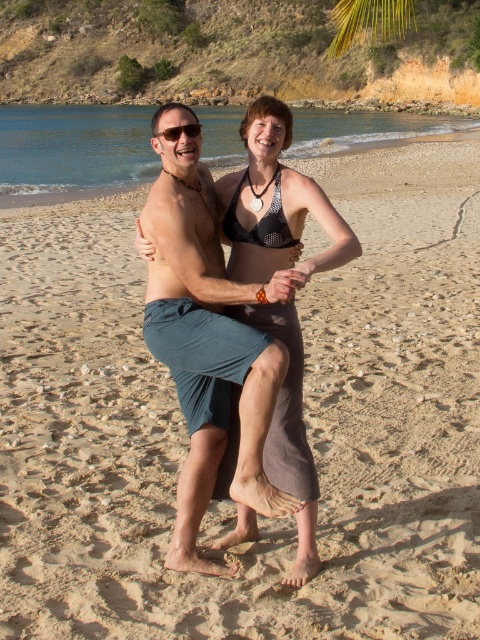
You are standing on the beach and want to walk towards the green leafy palm tree at upper right. Which direction should you turn to face the matte gray sarong at center first before proceeding?

To face the matte gray sarong at center first before proceeding to the green leafy palm tree at upper right, you should turn to your left since the matte gray sarong at center is located to the left of the palm tree.

You are standing at the beach and want to take a photo of both the matte gray sarong at center and the green leafy palm tree at upper right. Which object should you focus on first to ensure both are in the frame?

The matte gray sarong at center has a lesser height compared to the green leafy palm tree at upper right, so you should focus on the green leafy palm tree at upper right first to ensure both are in the frame.

You are standing on the beach and looking at two points marked on the sand. The first point is at coordinates point (144, 250) and the second point is at point (189, 125). Which point is closer to you?

Point (144, 250) is further to the viewer than point (189, 125), so the closer point to you is point (189, 125).